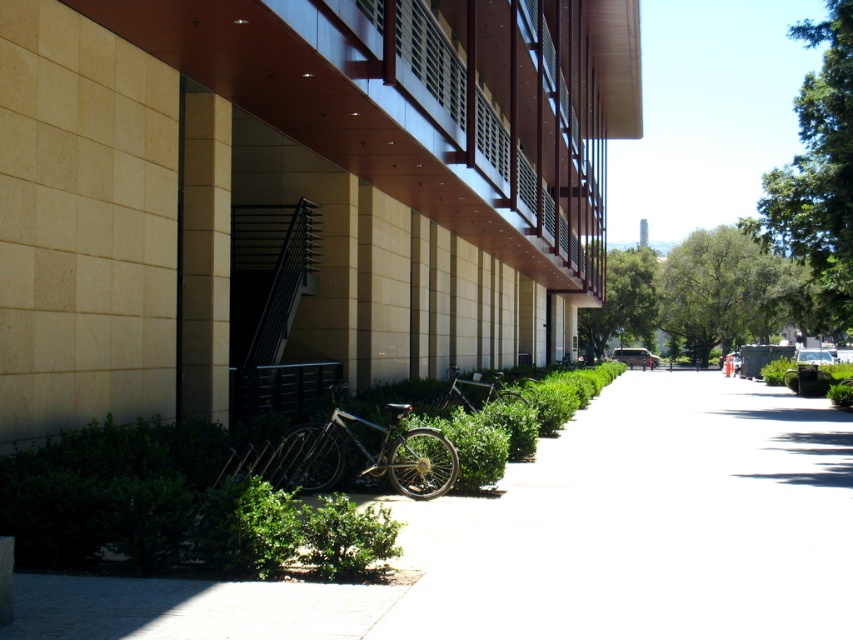
You are a delivery person standing on the white concrete pavement at lower center. You need to place a package on the ground near the shiny metallic bicycle at center. Can you place it directly below the bicycle?

The white concrete pavement at lower center is positioned under the shiny metallic bicycle at center, so yes, you can place the package directly below the bicycle on the white concrete pavement at lower center.

You are standing at the point marked as point [659,524] in the image. What is the object located exactly at this point?

The white concrete pavement at lower center is located exactly at point [659,524].